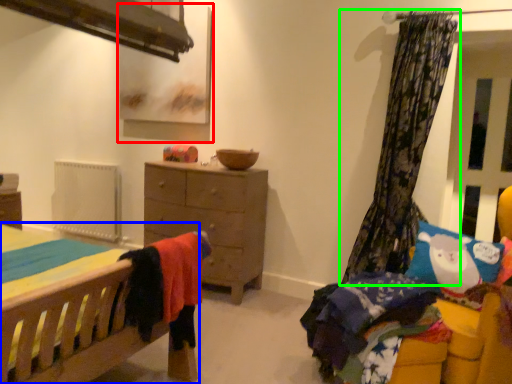
Question: Considering the real-world distances, which object is closest to picture frame (highlighted by a red box)? bed (highlighted by a blue box) or curtain (highlighted by a green box).

Choices:
 (A) bed
 (B) curtain

Answer: (B)